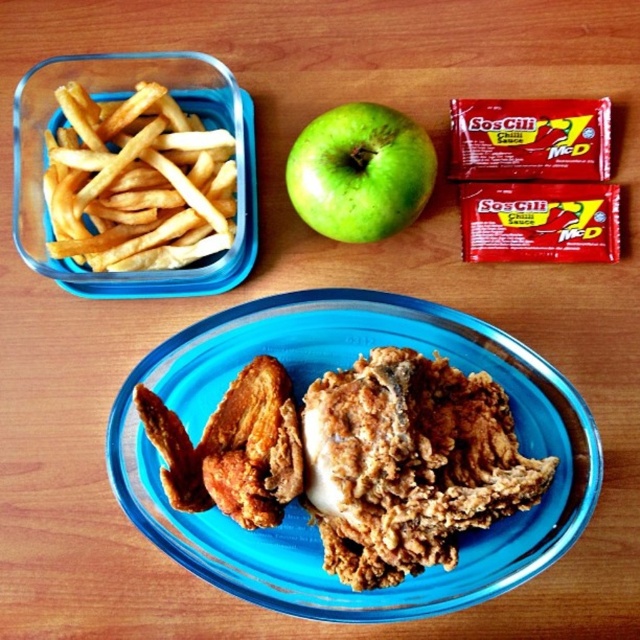
Does yellow crispy french fries at left appear on the left side of green matte apple at center?

Yes, yellow crispy french fries at left is to the left of green matte apple at center.

Is point (145, 177) positioned before point (332, 163)?

No, (145, 177) is behind (332, 163).

Locate an element on the screen. yellow crispy french fries at left is located at coordinates [x=138, y=182].

Which of these two, crispy fried chicken at center or green matte apple at center, stands taller?

With more height is crispy fried chicken at center.

Can you confirm if crispy fried chicken at center is positioned to the right of green matte apple at center?

No, crispy fried chicken at center is not to the right of green matte apple at center.

Which is in front, point (305, 365) or point (339, 140)?

Positioned in front is point (339, 140).

Locate an element on the screen. This screenshot has width=640, height=640. crispy fried chicken at center is located at coordinates (300, 397).

Can you confirm if crispy fried chicken at center is wider than yellow crispy french fries at left?

Indeed, crispy fried chicken at center has a greater width compared to yellow crispy french fries at left.

Between point (461, 582) and point (160, 170), which one is positioned in front?

Point (461, 582)

Where is `crispy fried chicken at center`? crispy fried chicken at center is located at coordinates (300, 397).